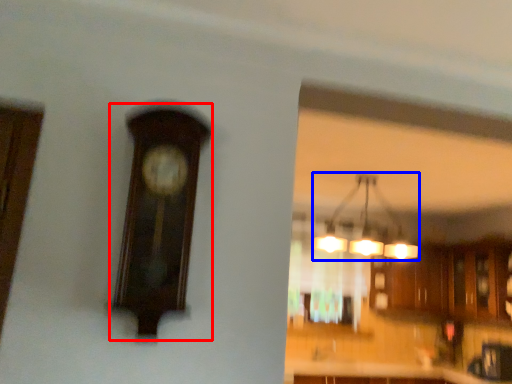
Question: Which point is further to the camera, clock (highlighted by a red box) or lamp (highlighted by a blue box)?

Choices:
 (A) clock
 (B) lamp

Answer: (B)